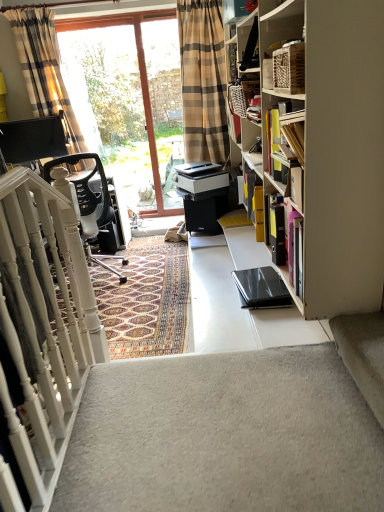
Image resolution: width=384 pixels, height=512 pixels. I want to click on vacant point above black glossy phone at right (from a real-world perspective), so click(x=262, y=292).